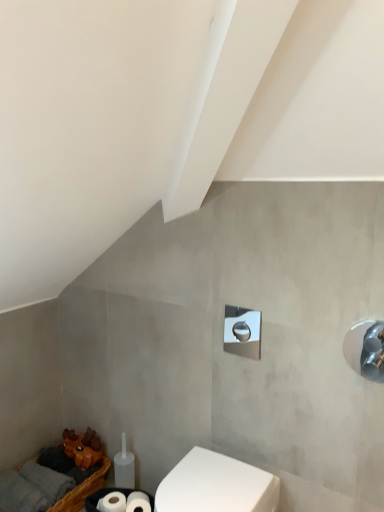
Locate an element on the screen. This screenshot has width=384, height=512. polished chrome shower at center, which is the 1th shower in back-to-front order is located at coordinates (242, 332).

What is the approximate height of polished chrome shower at center, marked as the second shower in a front-to-back arrangement?

The height of polished chrome shower at center, marked as the second shower in a front-to-back arrangement, is 8.25 inches.

What are the coordinates of `brown woven basket at lower left` in the screenshot? It's located at (69, 493).

You are a GUI agent. You are given a task and a screenshot of the screen. Output one action in this format:
    pyautogui.click(x=<x>, y=<y>)
    Task: Click on the polished chrome shower at right, the second shower in the back-to-front sequence
    
    Given the screenshot: What is the action you would take?
    pyautogui.click(x=365, y=349)

Locate an element on the screen. This screenshot has width=384, height=512. white glossy toilet at lower center is located at coordinates (216, 485).

What do you see at coordinates (216, 485) in the screenshot? The image size is (384, 512). I see `white glossy toilet at lower center` at bounding box center [216, 485].

You are a GUI agent. You are given a task and a screenshot of the screen. Output one action in this format:
    pyautogui.click(x=<x>, y=<y>)
    Task: Click on the polished chrome shower at center, marked as the second shower in a front-to-back arrangement
    The width and height of the screenshot is (384, 512).
    Given the screenshot: What is the action you would take?
    pyautogui.click(x=242, y=332)

Is polished chrome shower at right, the second shower in the back-to-front sequence, thinner than white glossy toilet at lower center?

Correct, the width of polished chrome shower at right, the second shower in the back-to-front sequence, is less than that of white glossy toilet at lower center.

Is polished chrome shower at right, which is counted as the first shower, starting from the right, far from white glossy toilet at lower center?

polished chrome shower at right, which is counted as the first shower, starting from the right, is actually quite close to white glossy toilet at lower center.

Is polished chrome shower at right, arranged as the 2th shower when viewed from the left, looking in the opposite direction of white glossy toilet at lower center?

No.

Can we say polished chrome shower at right, which is counted as the first shower, starting from the right, lies outside white glossy toilet at lower center?

Absolutely, polished chrome shower at right, which is counted as the first shower, starting from the right, is external to white glossy toilet at lower center.

Can you confirm if polished chrome shower at center, which is the 1th shower in back-to-front order, is positioned to the left of brown woven basket at lower left?

In fact, polished chrome shower at center, which is the 1th shower in back-to-front order, is to the right of brown woven basket at lower left.

Measure the distance between polished chrome shower at center, which is the 2th shower in right-to-left order, and brown woven basket at lower left.

A distance of 1.03 meters exists between polished chrome shower at center, which is the 2th shower in right-to-left order, and brown woven basket at lower left.

Consider the image. In the image, is polished chrome shower at center, which ranks as the 1th shower in left-to-right order, positioned in front of or behind brown woven basket at lower left?

Clearly, polished chrome shower at center, which ranks as the 1th shower in left-to-right order, is in front of brown woven basket at lower left.

Can you confirm if polished chrome shower at center, which is the 1th shower in back-to-front order, is taller than brown woven basket at lower left?

No.

Where is `shower located below the polished chrome shower at center, which ranks as the 1th shower in left-to-right order (from the image's perspective)`? shower located below the polished chrome shower at center, which ranks as the 1th shower in left-to-right order (from the image's perspective) is located at coordinates (365, 349).

Considering the sizes of objects polished chrome shower at right, which is counted as the first shower, starting from the right, and polished chrome shower at center, marked as the second shower in a front-to-back arrangement, in the image provided, who is smaller, polished chrome shower at right, which is counted as the first shower, starting from the right, or polished chrome shower at center, marked as the second shower in a front-to-back arrangement,?

With smaller size is polished chrome shower at right, which is counted as the first shower, starting from the right.

Considering the relative positions of polished chrome shower at right, the second shower in the back-to-front sequence, and polished chrome shower at center, which is the 1th shower in back-to-front order, in the image provided, is polished chrome shower at right, the second shower in the back-to-front sequence, in front of polished chrome shower at center, which is the 1th shower in back-to-front order,?

That is True.

Can you tell me how much polished chrome shower at right, which ranks as the first shower in front-to-back order, and polished chrome shower at center, marked as the second shower in a front-to-back arrangement, differ in facing direction?

They differ by 0.82 degrees in their facing directions.

Is white glossy toilet at lower center completely or partially inside brown woven basket at lower left?

No, brown woven basket at lower left does not contain white glossy toilet at lower center.

Considering the positions of point (58, 507) and point (201, 498), is point (58, 507) closer or farther from the camera than point (201, 498)?

Point (58, 507) is positioned farther from the camera compared to point (201, 498).

From a real-world perspective, is brown woven basket at lower left over white glossy toilet at lower center?

Incorrect, from a real-world perspective, brown woven basket at lower left is lower than white glossy toilet at lower center.

Is polished chrome shower at center, which is the 1th shower in back-to-front order, surrounded by brown woven basket at lower left?

No, polished chrome shower at center, which is the 1th shower in back-to-front order, is located outside of brown woven basket at lower left.

Who is bigger, brown woven basket at lower left or polished chrome shower at center, which ranks as the 1th shower in left-to-right order?

brown woven basket at lower left is bigger.

Which point is more forward, (6, 510) or (234, 349)?

The point (234, 349) is closer to the camera.

How different are the orientations of brown woven basket at lower left and polished chrome shower at center, which ranks as the 1th shower in left-to-right order, in degrees?

The angular difference between brown woven basket at lower left and polished chrome shower at center, which ranks as the 1th shower in left-to-right order, is 2.15 degrees.

Which is farther, (39, 509) or (360, 350)?

The point (39, 509) is farther from the camera.

Between brown woven basket at lower left and polished chrome shower at right, which ranks as the first shower in front-to-back order, which one appears on the right side from the viewer's perspective?

polished chrome shower at right, which ranks as the first shower in front-to-back order, is more to the right.

Is brown woven basket at lower left next to polished chrome shower at right, which is counted as the first shower, starting from the right, and touching it?

There is a gap between brown woven basket at lower left and polished chrome shower at right, which is counted as the first shower, starting from the right.

Is brown woven basket at lower left facing away from polished chrome shower at right, arranged as the 2th shower when viewed from the left?

No, polished chrome shower at right, arranged as the 2th shower when viewed from the left, is not at the back of brown woven basket at lower left.

From the image's perspective, which object appears higher, polished chrome shower at right, the second shower in the back-to-front sequence, or brown woven basket at lower left?

polished chrome shower at right, the second shower in the back-to-front sequence, appears higher in the image.

Could you measure the distance between polished chrome shower at right, which ranks as the first shower in front-to-back order, and brown woven basket at lower left?

polished chrome shower at right, which ranks as the first shower in front-to-back order, is 1.41 meters from brown woven basket at lower left.

From a real-world perspective, which is physically above, polished chrome shower at right, which is counted as the first shower, starting from the right, or brown woven basket at lower left?

From a 3D spatial view, polished chrome shower at right, which is counted as the first shower, starting from the right, is above.

Is polished chrome shower at right, the second shower in the back-to-front sequence, surrounding brown woven basket at lower left?

No.

You are a GUI agent. You are given a task and a screenshot of the screen. Output one action in this format:
    pyautogui.click(x=<x>, y=<y>)
    Task: Click on the toilet in front of the polished chrome shower at right, arranged as the 2th shower when viewed from the left
    The image size is (384, 512).
    Given the screenshot: What is the action you would take?
    pyautogui.click(x=216, y=485)

Locate an element on the screen. Image resolution: width=384 pixels, height=512 pixels. the 2nd shower above the brown woven basket at lower left (from the image's perspective) is located at coordinates coord(242,332).

Which object lies nearer to the anchor point white glossy toilet at lower center, polished chrome shower at center, which is the 1th shower in back-to-front order, or polished chrome shower at right, the second shower in the back-to-front sequence?

polished chrome shower at center, which is the 1th shower in back-to-front order, lies closer to white glossy toilet at lower center than the other object.

When comparing their distances from polished chrome shower at center, which is the 2th shower in right-to-left order, does brown woven basket at lower left or polished chrome shower at right, the second shower in the back-to-front sequence, seem further?

Based on the image, brown woven basket at lower left appears to be further to polished chrome shower at center, which is the 2th shower in right-to-left order.

Consider the image. Estimate the real-world distances between objects in this image. Which object is closer to polished chrome shower at right, which is counted as the first shower, starting from the right, white glossy toilet at lower center or polished chrome shower at center, marked as the second shower in a front-to-back arrangement?

The object closer to polished chrome shower at right, which is counted as the first shower, starting from the right, is polished chrome shower at center, marked as the second shower in a front-to-back arrangement.

From the image, which object appears to be farther from polished chrome shower at center, which is the 1th shower in back-to-front order, polished chrome shower at right, the second shower in the back-to-front sequence, or white glossy toilet at lower center?

Among the two, white glossy toilet at lower center is located further to polished chrome shower at center, which is the 1th shower in back-to-front order.

Based on the photo, looking at the image, which one is located closer to polished chrome shower at right, which is counted as the first shower, starting from the right, brown woven basket at lower left or polished chrome shower at center, which ranks as the 1th shower in left-to-right order?

polished chrome shower at center, which ranks as the 1th shower in left-to-right order, is positioned closer to the anchor polished chrome shower at right, which is counted as the first shower, starting from the right.

When comparing their distances from brown woven basket at lower left, does polished chrome shower at center, which is the 2th shower in right-to-left order, or white glossy toilet at lower center seem further?

Among the two, polished chrome shower at center, which is the 2th shower in right-to-left order, is located further to brown woven basket at lower left.

Estimate the real-world distances between objects in this image. Which object is further from white glossy toilet at lower center, polished chrome shower at right, which is counted as the first shower, starting from the right, or brown woven basket at lower left?

brown woven basket at lower left is positioned further to the anchor white glossy toilet at lower center.

From the picture: Looking at the image, which one is located further to white glossy toilet at lower center, brown woven basket at lower left or polished chrome shower at center, which is the 2th shower in right-to-left order?

Among the two, brown woven basket at lower left is located further to white glossy toilet at lower center.

I want to click on toilet between brown woven basket at lower left and polished chrome shower at right, the second shower in the back-to-front sequence, so click(x=216, y=485).

I want to click on toilet between brown woven basket at lower left and polished chrome shower at center, which is the 1th shower in back-to-front order, in the horizontal direction, so click(x=216, y=485).

Where is `shower between polished chrome shower at center, which is the 2th shower in right-to-left order, and white glossy toilet at lower center from top to bottom`? The image size is (384, 512). shower between polished chrome shower at center, which is the 2th shower in right-to-left order, and white glossy toilet at lower center from top to bottom is located at coordinates (365, 349).

At what (x,y) coordinates should I click in order to perform the action: click on shower between brown woven basket at lower left and polished chrome shower at right, arranged as the 2th shower when viewed from the left, from left to right. Please return your answer as a coordinate pair (x, y). Looking at the image, I should click on (242, 332).